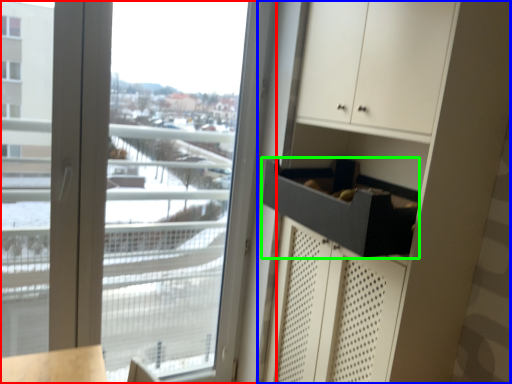
Question: Which is farther away from window (highlighted by a red box)? dresser (highlighted by a blue box) or drawer (highlighted by a green box)?

Choices:
 (A) dresser
 (B) drawer

Answer: (B)